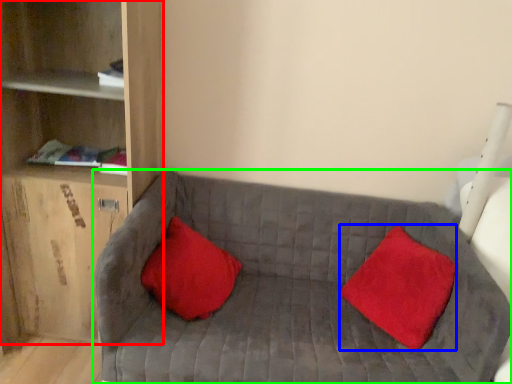
Question: Which object is positioned farthest from shelf (highlighted by a red box)? Select from pillow (highlighted by a blue box) and studio couch (highlighted by a green box).

Choices:
 (A) pillow
 (B) studio couch

Answer: (A)